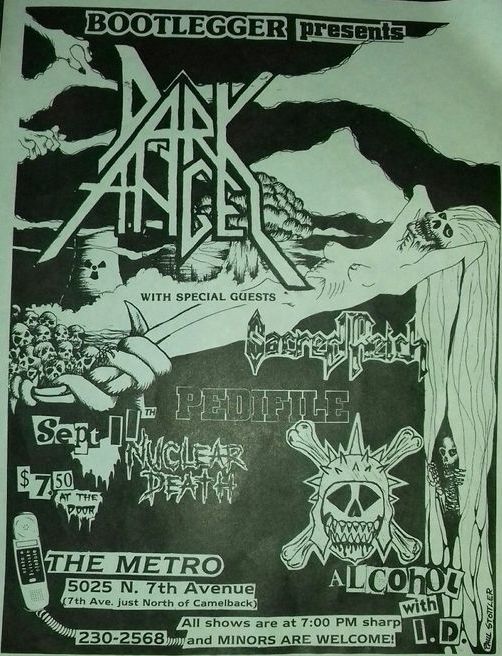
You are a GUI agent. You are given a task and a screenshot of the screen. Output one action in this format:
    pyautogui.click(x=<x>, y=<y>)
    Task: Click on the phone
    The width and height of the screenshot is (502, 656).
    Given the screenshot: What is the action you would take?
    pyautogui.click(x=36, y=586)